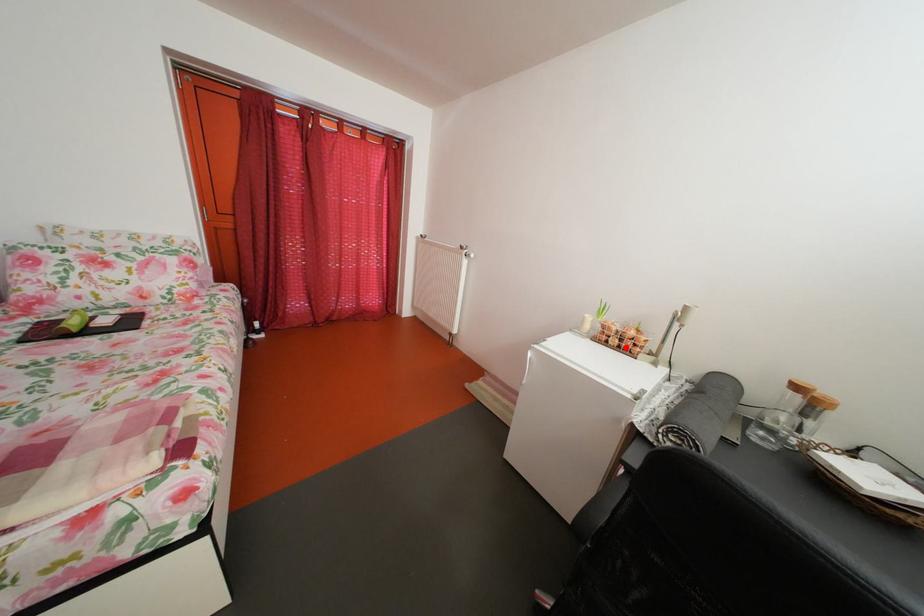
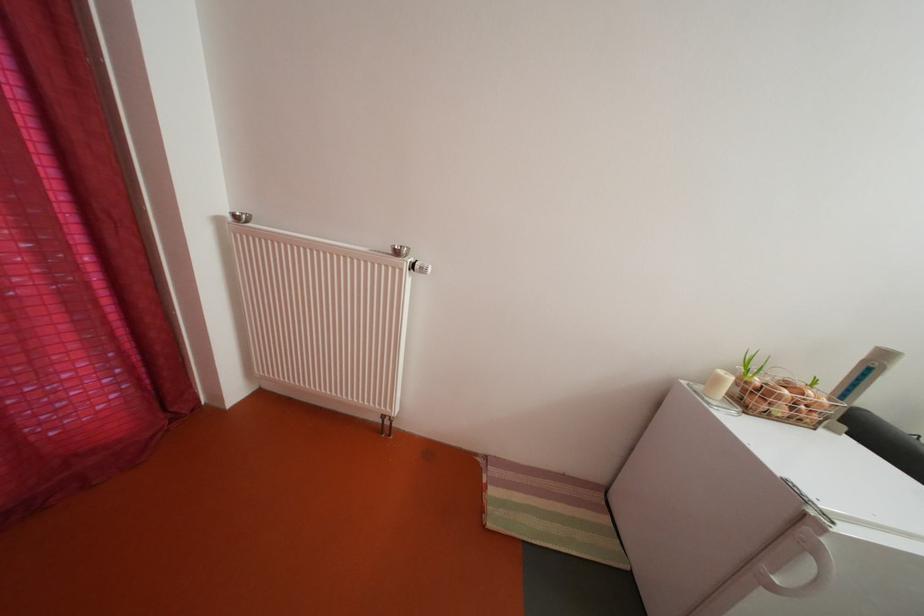
Find the pixel in the second image that matches the highlighted location in the first image.

(792, 416)